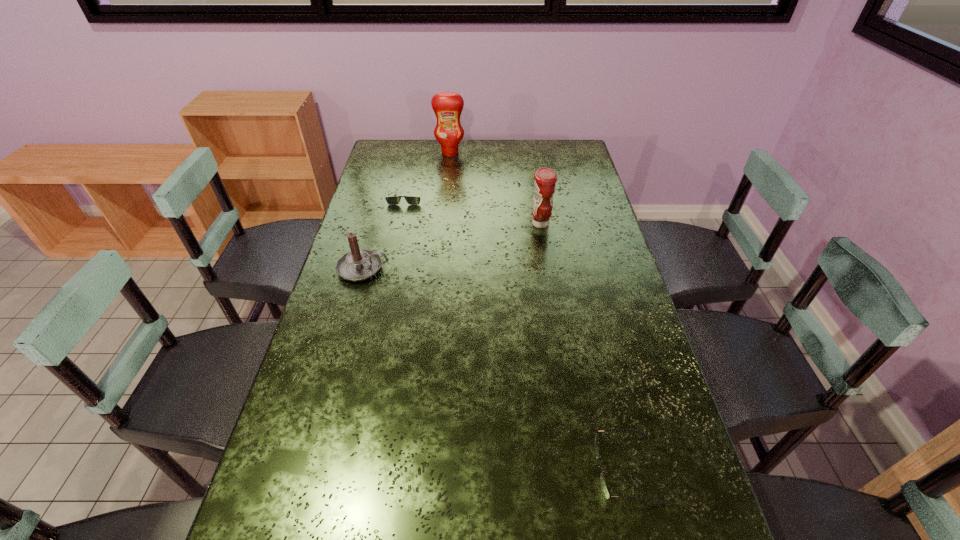
The image size is (960, 540). What are the coordinates of `the farther condiment` in the screenshot? It's located at (447, 106).

Find the location of a particular element. The height and width of the screenshot is (540, 960). the taller condiment is located at coordinates (447, 106).

Find the location of a particular element. Image resolution: width=960 pixels, height=540 pixels. the nearer condiment is located at coordinates (545, 178).

What are the coordinates of `the shorter condiment` in the screenshot? It's located at (545, 178).

Where is `the second nearest object`? the second nearest object is located at coordinates (360, 264).

The image size is (960, 540). Find the location of `the third shortest object`. the third shortest object is located at coordinates (360, 264).

What are the coordinates of `sunglasses` in the screenshot? It's located at (393, 200).

In order to click on the nearest object in this screenshot , I will do `click(603, 482)`.

Find the location of `free space located 0.230m on the label side of the farthest object`. free space located 0.230m on the label side of the farthest object is located at coordinates (446, 186).

Find the location of a particular element. This screenshot has width=960, height=540. free space located 0.280m on the front of the fourth shortest object is located at coordinates (551, 291).